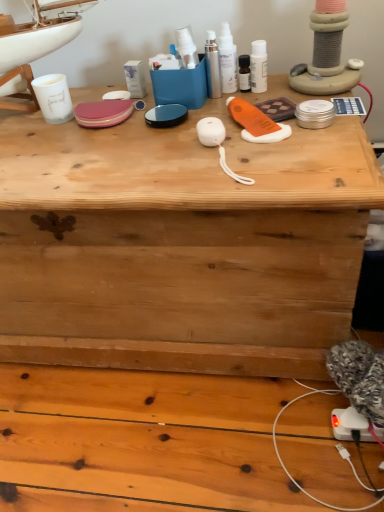
Where is `vacant area that is in front of white glossy spray bottles at upper center, arranged as the 2th toiletry when viewed from the left`? vacant area that is in front of white glossy spray bottles at upper center, arranged as the 2th toiletry when viewed from the left is located at coordinates (223, 119).